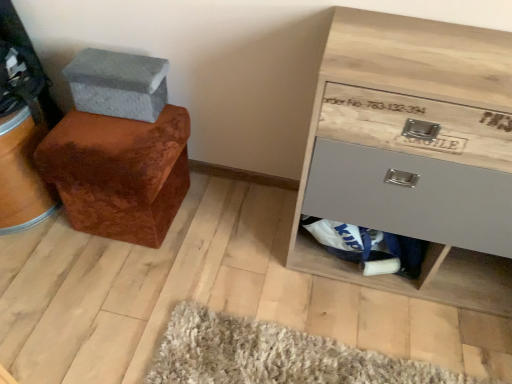
Identify the location of matte gray drawer at lower right. This screenshot has height=384, width=512. (368, 247).

Describe the element at coordinates (415, 152) in the screenshot. The height and width of the screenshot is (384, 512). I see `wooden chest of drawers at lower right` at that location.

What is the approximate width of velvet brown ottoman at left?

It is 15.55 inches.

This screenshot has height=384, width=512. What are the coordinates of `matte gray drawer at lower right` in the screenshot? It's located at (368, 247).

From the image's perspective, is matte gray drawer at lower right beneath wooden chest of drawers at lower right?

Indeed, from the image's perspective, matte gray drawer at lower right is shown beneath wooden chest of drawers at lower right.

From a real-world perspective, is matte gray drawer at lower right located higher than wooden chest of drawers at lower right?

No.

Does matte gray drawer at lower right have a greater width compared to wooden chest of drawers at lower right?

Incorrect, the width of matte gray drawer at lower right does not surpass that of wooden chest of drawers at lower right.

Consider the image. Who is shorter, velvet brown ottoman at left or gray fabric shoe box at upper left?

gray fabric shoe box at upper left.

Consider the image. Are velvet brown ottoman at left and gray fabric shoe box at upper left located far from each other?

They are positioned close to each other.

Measure the distance between velvet brown ottoman at left and gray fabric shoe box at upper left.

velvet brown ottoman at left and gray fabric shoe box at upper left are 7.19 inches apart from each other.

Which of these two, velvet brown ottoman at left or gray fabric shoe box at upper left, is bigger?

With larger size is velvet brown ottoman at left.

Is velvet brown ottoman at left taller than wooden chest of drawers at lower right?

No.

Visually, is velvet brown ottoman at left positioned to the left or to the right of wooden chest of drawers at lower right?

velvet brown ottoman at left is to the left of wooden chest of drawers at lower right.

Are velvet brown ottoman at left and wooden chest of drawers at lower right far apart?

They are positioned close to each other.

Is velvet brown ottoman at left spatially inside wooden chest of drawers at lower right, or outside of it?

velvet brown ottoman at left is located beyond the bounds of wooden chest of drawers at lower right.

Is matte gray drawer at lower right oriented away from gray fabric shoe box at upper left?

No, matte gray drawer at lower right is not facing the opposite direction of gray fabric shoe box at upper left.

Measure the distance from matte gray drawer at lower right to gray fabric shoe box at upper left.

matte gray drawer at lower right and gray fabric shoe box at upper left are 30.21 inches apart from each other.

From their relative heights in the image, would you say matte gray drawer at lower right is taller or shorter than gray fabric shoe box at upper left?

In the image, matte gray drawer at lower right appears to be taller than gray fabric shoe box at upper left.

How different are the orientations of gray fabric shoe box at upper left and wooden chest of drawers at lower right in degrees?

3.57 degrees.

Between point (160, 70) and point (318, 149), which one is positioned in front?

The point (318, 149) is in front.

Is wooden chest of drawers at lower right at the back of gray fabric shoe box at upper left?

No, wooden chest of drawers at lower right is not at the back of gray fabric shoe box at upper left.

Based on the photo, are gray fabric shoe box at upper left and wooden chest of drawers at lower right far apart?

gray fabric shoe box at upper left is near wooden chest of drawers at lower right, not far away.

From a real-world perspective, relative to matte gray drawer at lower right, is wooden chest of drawers at lower right vertically above or below?

In terms of real-world spatial position, wooden chest of drawers at lower right is above matte gray drawer at lower right.

Is wooden chest of drawers at lower right aimed at matte gray drawer at lower right?

Yes, wooden chest of drawers at lower right is facing matte gray drawer at lower right.

From the picture: Between wooden chest of drawers at lower right and matte gray drawer at lower right, which one has larger size?

wooden chest of drawers at lower right.

Is velvet brown ottoman at left next to matte gray drawer at lower right?

No, velvet brown ottoman at left is not next to matte gray drawer at lower right.

In terms of width, does velvet brown ottoman at left look wider or thinner when compared to matte gray drawer at lower right?

In the image, velvet brown ottoman at left appears to be wider than matte gray drawer at lower right.

In the scene shown: Which point is more forward, (79,157) or (381,232)?

The point (79,157) is closer to the camera.

Between velvet brown ottoman at left and matte gray drawer at lower right, which one is positioned in front?

velvet brown ottoman at left.

I want to click on material on the left side of wooden chest of drawers at lower right, so click(x=368, y=247).

Identify the location of furniture below the gray fabric shoe box at upper left (from a real-world perspective). The height and width of the screenshot is (384, 512). (119, 173).

Looking at the image, which one is located further to matte gray drawer at lower right, velvet brown ottoman at left or wooden chest of drawers at lower right?

The object further to matte gray drawer at lower right is velvet brown ottoman at left.

Based on their spatial positions, is velvet brown ottoman at left or matte gray drawer at lower right closer to gray fabric shoe box at upper left?

velvet brown ottoman at left is positioned closer to the anchor gray fabric shoe box at upper left.

When comparing their distances from gray fabric shoe box at upper left, does wooden chest of drawers at lower right or matte gray drawer at lower right seem closer?

wooden chest of drawers at lower right lies closer to gray fabric shoe box at upper left than the other object.

Based on their spatial positions, is matte gray drawer at lower right or wooden chest of drawers at lower right closer to gray fabric shoe box at upper left?

wooden chest of drawers at lower right lies closer to gray fabric shoe box at upper left than the other object.

When comparing their distances from wooden chest of drawers at lower right, does velvet brown ottoman at left or gray fabric shoe box at upper left seem closer?

velvet brown ottoman at left lies closer to wooden chest of drawers at lower right than the other object.

Which object lies further to the anchor point velvet brown ottoman at left, matte gray drawer at lower right or gray fabric shoe box at upper left?

Based on the image, matte gray drawer at lower right appears to be further to velvet brown ottoman at left.

Considering their positions, is gray fabric shoe box at upper left positioned closer to matte gray drawer at lower right than velvet brown ottoman at left?

velvet brown ottoman at left is closer to matte gray drawer at lower right.

Based on their spatial positions, is wooden chest of drawers at lower right or velvet brown ottoman at left closer to matte gray drawer at lower right?

wooden chest of drawers at lower right lies closer to matte gray drawer at lower right than the other object.

Find the location of `shoe box located between velvet brown ottoman at left and matte gray drawer at lower right in the left-right direction`. shoe box located between velvet brown ottoman at left and matte gray drawer at lower right in the left-right direction is located at coordinates (118, 84).

I want to click on material located between velvet brown ottoman at left and wooden chest of drawers at lower right in the left-right direction, so click(x=368, y=247).

Where is `shoe box located between velvet brown ottoman at left and wooden chest of drawers at lower right in the left-right direction`? shoe box located between velvet brown ottoman at left and wooden chest of drawers at lower right in the left-right direction is located at coordinates (118, 84).

You are a GUI agent. You are given a task and a screenshot of the screen. Output one action in this format:
    pyautogui.click(x=<x>, y=<y>)
    Task: Click on the material located between gray fabric shoe box at upper left and wooden chest of drawers at lower right in the left-right direction
    
    Given the screenshot: What is the action you would take?
    pyautogui.click(x=368, y=247)